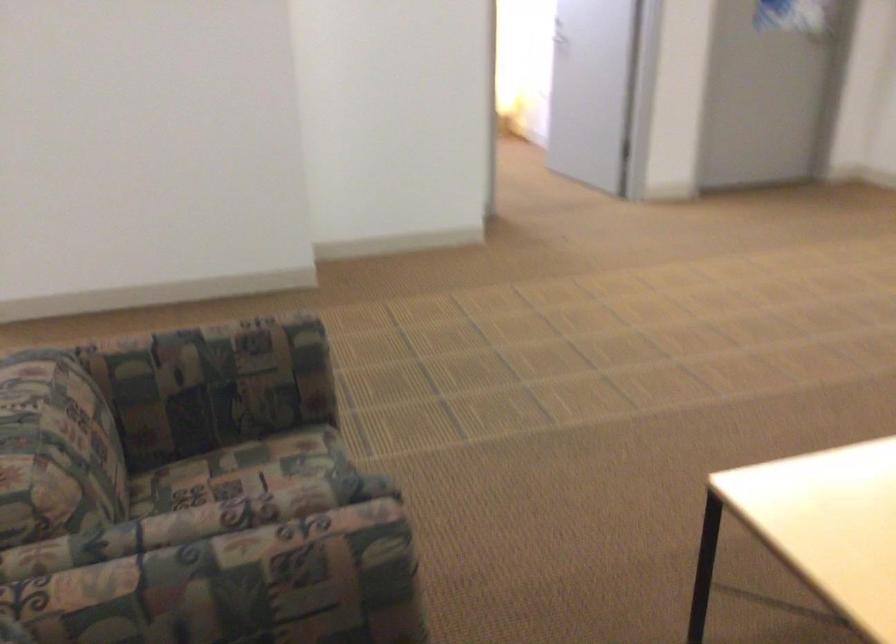
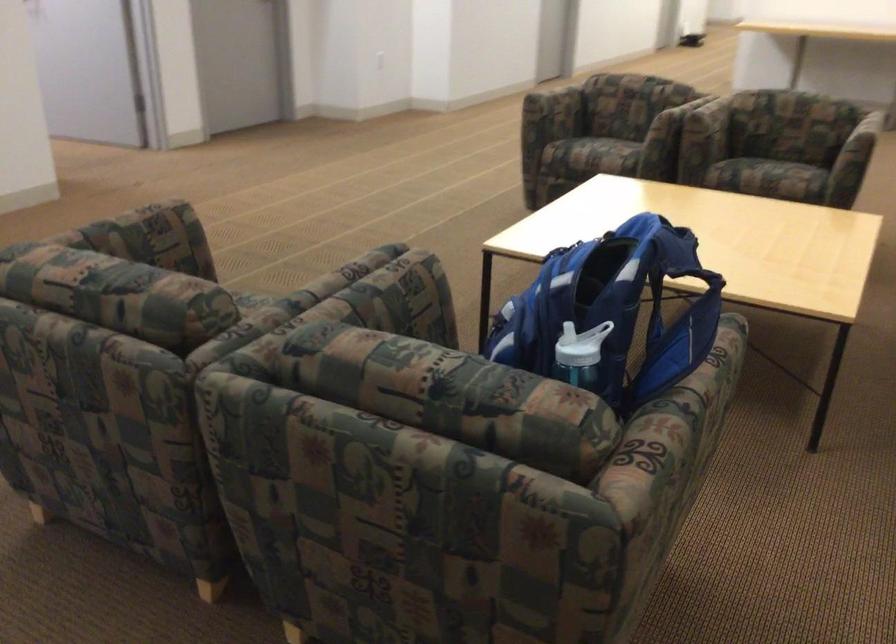
Locate, in the second image, the point that corresponds to (x=203, y=564) in the first image.

(362, 292)